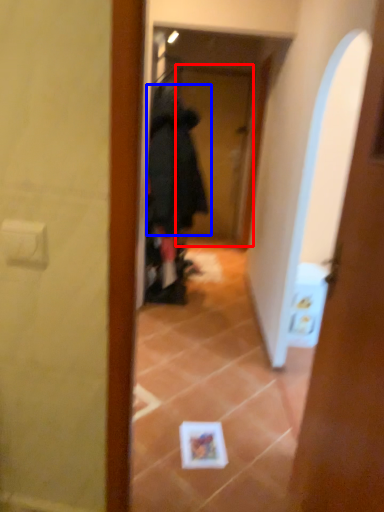
Question: Which of the following is the farthest to the observer, screen door (highlighted by a red box) or bathrobe (highlighted by a blue box)?

Choices:
 (A) screen door
 (B) bathrobe

Answer: (A)